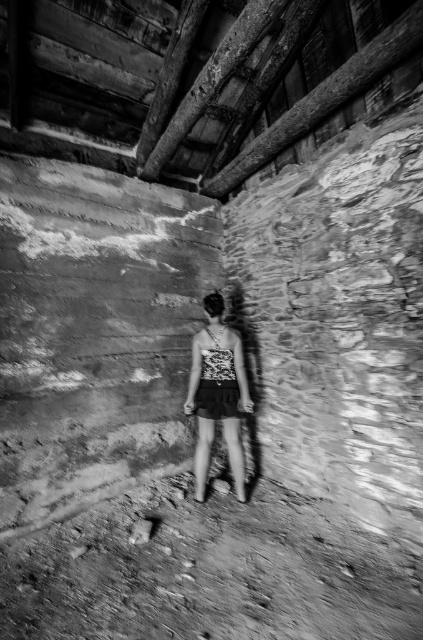
Question: Observing the image, what is the correct spatial positioning of dirt track at lower center in reference to printed fabric tank top at center?

Choices:
 (A) below
 (B) above

Answer: (A)

Question: Is dirt track at lower center positioned in front of printed fabric tank top at center?

Choices:
 (A) yes
 (B) no

Answer: (A)

Question: Does dirt track at lower center have a lesser width compared to printed fabric tank top at center?

Choices:
 (A) yes
 (B) no

Answer: (B)

Question: Which object is closer to the camera taking this photo?

Choices:
 (A) dirt track at lower center
 (B) printed fabric tank top at center

Answer: (A)